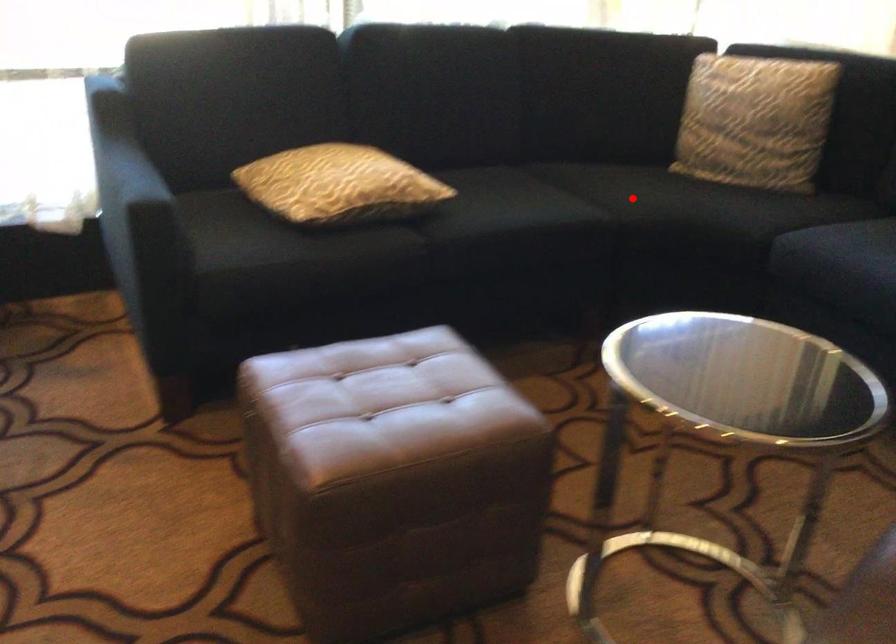
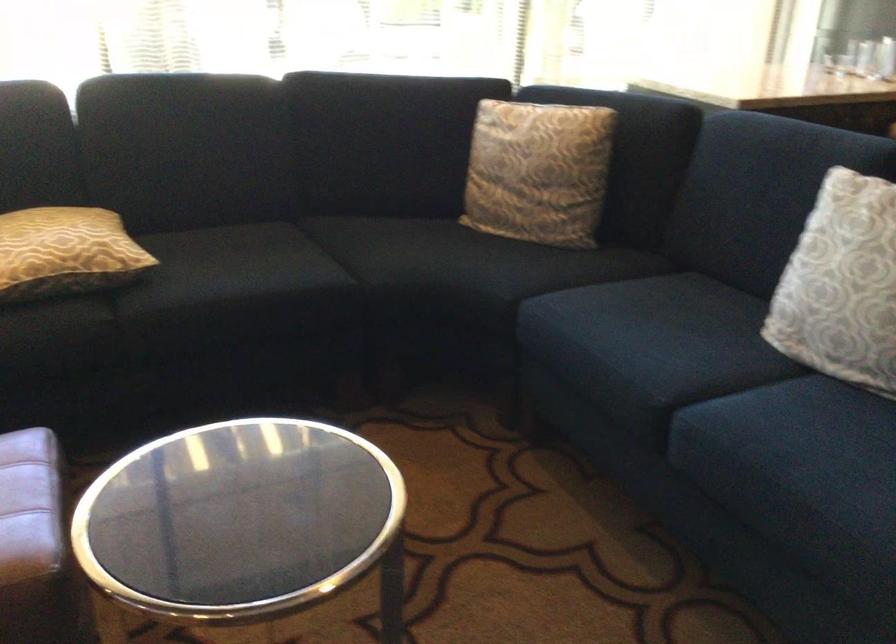
Where in the second image is the point corresponding to the highlighted location from the first image?

(391, 261)